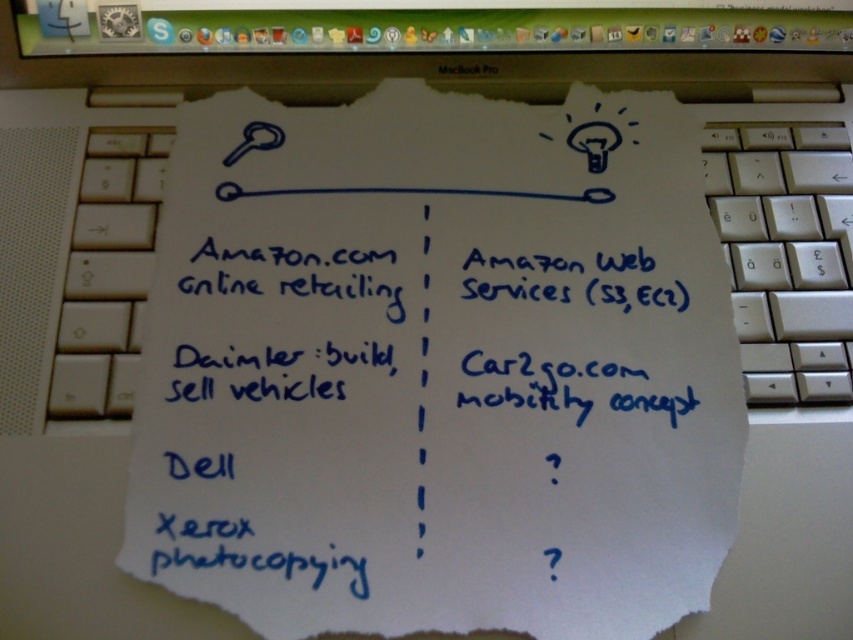
Does black glossy computer screen at upper center appear over white plastic keyboard at right?

Yes, black glossy computer screen at upper center is above white plastic keyboard at right.

Does black glossy computer screen at upper center have a greater height compared to white plastic keyboard at right?

No, black glossy computer screen at upper center is not taller than white plastic keyboard at right.

Between point (195, 40) and point (801, 198), which one is positioned behind?

The point (195, 40) is more distant.

You are a GUI agent. You are given a task and a screenshot of the screen. Output one action in this format:
    pyautogui.click(x=<x>, y=<y>)
    Task: Click on the black glossy computer screen at upper center
    Image resolution: width=853 pixels, height=640 pixels.
    Given the screenshot: What is the action you would take?
    pyautogui.click(x=425, y=42)